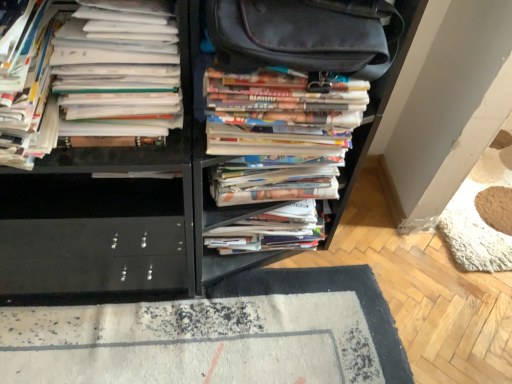
Consider the image. What is the approximate height of multicolored paper stack at center, placed as the 1th book when sorted from right to left?

6.29 inches.

Where is `multicolored paper stack at center, placed as the 1th book when sorted from right to left`? multicolored paper stack at center, placed as the 1th book when sorted from right to left is located at coordinates (273, 120).

Considering the positions of objects multicolored paper stack at center, acting as the fourth book starting from the left, and white paper stack at left, which is the 4th book from right to left, in the image provided, who is more to the left, multicolored paper stack at center, acting as the fourth book starting from the left, or white paper stack at left, which is the 4th book from right to left,?

white paper stack at left, which is the 4th book from right to left.

Is multicolored paper stack at center, placed as the 1th book when sorted from right to left, looking in the opposite direction of white paper stack at left, which is the first book in left-to-right order?

multicolored paper stack at center, placed as the 1th book when sorted from right to left, does not have its back to white paper stack at left, which is the first book in left-to-right order.

Can you tell me how much multicolored paper stack at center, acting as the fourth book starting from the left, and white paper stack at left, which is the 4th book from right to left, differ in facing direction?

The angle between the facing direction of multicolored paper stack at center, acting as the fourth book starting from the left, and the facing direction of white paper stack at left, which is the 4th book from right to left, is 2.77 degrees.

Is multicolored paper stack at center, acting as the fourth book starting from the left, next to white paper stack at left, which is the first book in left-to-right order?

multicolored paper stack at center, acting as the fourth book starting from the left, and white paper stack at left, which is the first book in left-to-right order, are not in contact.

Considering their positions, is white paper stack at left, arranged as the second book when viewed from the left, located in front of or behind white paper stack at center, which appears as the third book when viewed from the left?

Clearly, white paper stack at left, arranged as the second book when viewed from the left, is in front of white paper stack at center, which appears as the third book when viewed from the left.

Looking at this image, between white paper stack at left, which is the third book in right-to-left order, and white paper stack at center, which appears as the third book when viewed from the left, which one has smaller width?

Thinner between the two is white paper stack at center, which appears as the third book when viewed from the left.

In order to click on the 2nd book positioned below the white paper stack at left, which is the third book in right-to-left order (from the image's perspective) in this screenshot , I will do `click(268, 233)`.

Consider the image. Does white paper stack at left, which is the third book in right-to-left order, have a larger size compared to white paper stack at center, which appears as the third book when viewed from the left?

No.

From the image's perspective, is white paper stack at left, arranged as the second book when viewed from the left, beneath white paper stack at left, which is the 4th book from right to left?

Yes, from the image's perspective, white paper stack at left, arranged as the second book when viewed from the left, is beneath white paper stack at left, which is the 4th book from right to left.

Considering the relative sizes of white paper stack at left, which is the third book in right-to-left order, and white paper stack at left, which is the 4th book from right to left, in the image provided, is white paper stack at left, which is the third book in right-to-left order, taller than white paper stack at left, which is the 4th book from right to left,?

Indeed, white paper stack at left, which is the third book in right-to-left order, has a greater height compared to white paper stack at left, which is the 4th book from right to left.

In the scene shown: Is white paper stack at left, arranged as the second book when viewed from the left, looking in the opposite direction of white paper stack at left, which is the first book in left-to-right order?

white paper stack at left, arranged as the second book when viewed from the left, is not turned away from white paper stack at left, which is the first book in left-to-right order.

Considering the sizes of white paper stack at left, which is the third book in right-to-left order, and white paper stack at left, which is the first book in left-to-right order, in the image, is white paper stack at left, which is the third book in right-to-left order, bigger or smaller than white paper stack at left, which is the first book in left-to-right order,?

Considering their sizes, white paper stack at left, which is the third book in right-to-left order, takes up more space than white paper stack at left, which is the first book in left-to-right order.

Could white paper stack at center, which appears as the third book when viewed from the left, be considered to be inside multicolored paper stack at center, placed as the 1th book when sorted from right to left?

No.

Based on the photo, which is closer, (x=224, y=143) or (x=216, y=228)?

Point (x=224, y=143).

Is multicolored paper stack at center, placed as the 1th book when sorted from right to left, to the left or to the right of white paper stack at center, the 2th book from the right, in the image?

multicolored paper stack at center, placed as the 1th book when sorted from right to left, is positioned on white paper stack at center, the 2th book from the right,'s right side.

From the image's perspective, is multicolored paper stack at center, acting as the fourth book starting from the left, located beneath white paper stack at center, which appears as the third book when viewed from the left?

No, from the image's perspective, multicolored paper stack at center, acting as the fourth book starting from the left, is not beneath white paper stack at center, which appears as the third book when viewed from the left.

This screenshot has width=512, height=384. Identify the location of book that is the 3rd object located below the white paper stack at left, which is the 4th book from right to left (from the image's perspective). (268, 233).

Based on the photo, would you consider white paper stack at center, the 2th book from the right, to be distant from white paper stack at left, which is the 4th book from right to left?

No, white paper stack at center, the 2th book from the right, is not far from white paper stack at left, which is the 4th book from right to left.

Is white paper stack at center, the 2th book from the right, oriented away from white paper stack at left, which is the 4th book from right to left?

No, white paper stack at center, the 2th book from the right, is not facing the opposite direction of white paper stack at left, which is the 4th book from right to left.

Is white paper stack at center, which appears as the third book when viewed from the left, to the left or to the right of white paper stack at left, which is the 4th book from right to left, in the image?

In the image, white paper stack at center, which appears as the third book when viewed from the left, appears on the right side of white paper stack at left, which is the 4th book from right to left.

Can white paper stack at left, arranged as the second book when viewed from the left, be found inside white paper stack at center, which appears as the third book when viewed from the left?

No, white paper stack at left, arranged as the second book when viewed from the left, is not a part of white paper stack at center, which appears as the third book when viewed from the left.

Starting from the white paper stack at center, which appears as the third book when viewed from the left, which book is the 2nd one in front? Please provide its 2D coordinates.

[(106, 78)]

From a real-world perspective, is white paper stack at center, the 2th book from the right, above or below white paper stack at left, arranged as the second book when viewed from the left?

From a real-world perspective, white paper stack at center, the 2th book from the right, is physically below white paper stack at left, arranged as the second book when viewed from the left.

From the image's perspective, does white paper stack at center, which appears as the third book when viewed from the left, appear higher than white paper stack at left, arranged as the second book when viewed from the left?

No, from the image's perspective, white paper stack at center, which appears as the third book when viewed from the left, is not on top of white paper stack at left, arranged as the second book when viewed from the left.

Which object is wider, white paper stack at left, which is the first book in left-to-right order, or white paper stack at left, which is the third book in right-to-left order?

white paper stack at left, which is the first book in left-to-right order.

Could you tell me if white paper stack at left, which is the 4th book from right to left, is turned towards white paper stack at left, which is the third book in right-to-left order?

No.

Identify the location of book that is the 1st object to the right of the white paper stack at left, which is the 4th book from right to left, starting at the anchor. (106, 78).

Are white paper stack at left, which is the 4th book from right to left, and white paper stack at left, arranged as the second book when viewed from the left, located far from each other?

No, white paper stack at left, which is the 4th book from right to left, is not far from white paper stack at left, arranged as the second book when viewed from the left.

At what (x,y) coordinates should I click in order to perform the action: click on book that is the 2nd one when counting forward from the multicolored paper stack at center, acting as the fourth book starting from the left. Please return your answer as a coordinate pair (x, y). Image resolution: width=512 pixels, height=384 pixels. Looking at the image, I should click on (29, 91).

From the image's perspective, starting from the white paper stack at left, which is the third book in right-to-left order, which book is the 2nd one below? Please provide its 2D coordinates.

[(268, 233)]

Based on their spatial positions, is white paper stack at center, which appears as the third book when viewed from the left, or white paper stack at left, which is the first book in left-to-right order, further from multicolored paper stack at center, placed as the 1th book when sorted from right to left?

white paper stack at left, which is the first book in left-to-right order, is positioned further to the anchor multicolored paper stack at center, placed as the 1th book when sorted from right to left.

Estimate the real-world distances between objects in this image. Which object is further from white paper stack at left, which is the first book in left-to-right order, multicolored paper stack at center, acting as the fourth book starting from the left, or white paper stack at left, arranged as the second book when viewed from the left?

The object further to white paper stack at left, which is the first book in left-to-right order, is multicolored paper stack at center, acting as the fourth book starting from the left.

Based on their spatial positions, is white paper stack at left, arranged as the second book when viewed from the left, or multicolored paper stack at center, acting as the fourth book starting from the left, further from white paper stack at center, which appears as the third book when viewed from the left?

white paper stack at left, arranged as the second book when viewed from the left, is positioned further to the anchor white paper stack at center, which appears as the third book when viewed from the left.

Which object lies further to the anchor point white paper stack at left, which is the third book in right-to-left order, multicolored paper stack at center, acting as the fourth book starting from the left, or white paper stack at left, which is the 4th book from right to left?

The object further to white paper stack at left, which is the third book in right-to-left order, is multicolored paper stack at center, acting as the fourth book starting from the left.

When comparing their distances from multicolored paper stack at center, acting as the fourth book starting from the left, does white paper stack at left, which is the third book in right-to-left order, or white paper stack at center, which appears as the third book when viewed from the left, seem closer?

Based on the image, white paper stack at left, which is the third book in right-to-left order, appears to be nearer to multicolored paper stack at center, acting as the fourth book starting from the left.

Estimate the real-world distances between objects in this image. Which object is further from white paper stack at left, which is the third book in right-to-left order, white paper stack at center, which appears as the third book when viewed from the left, or multicolored paper stack at center, placed as the 1th book when sorted from right to left?

The object further to white paper stack at left, which is the third book in right-to-left order, is white paper stack at center, which appears as the third book when viewed from the left.

Based on their spatial positions, is white paper stack at left, arranged as the second book when viewed from the left, or white paper stack at center, the 2th book from the right, closer to white paper stack at left, which is the first book in left-to-right order?

white paper stack at left, arranged as the second book when viewed from the left, lies closer to white paper stack at left, which is the first book in left-to-right order, than the other object.

Based on their spatial positions, is white paper stack at center, which appears as the third book when viewed from the left, or white paper stack at left, arranged as the second book when viewed from the left, closer to white paper stack at left, which is the 4th book from right to left?

white paper stack at left, arranged as the second book when viewed from the left, lies closer to white paper stack at left, which is the 4th book from right to left, than the other object.

What are the coordinates of `book between white paper stack at left, which is the third book in right-to-left order, and white paper stack at center, which appears as the third book when viewed from the left, from front to back` in the screenshot? It's located at (273, 120).